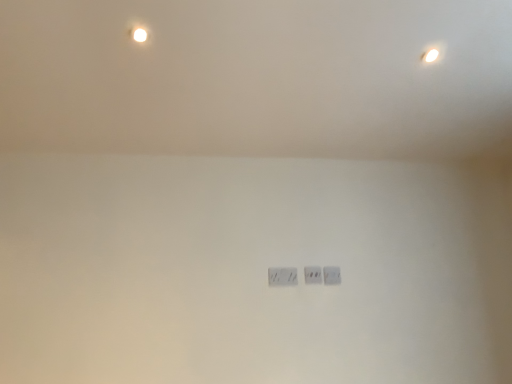
Question: From the image's perspective, is white plastic power plugs and sockets at center, which is counted as the first power plugs and sockets, starting from the left, over white plastic power plugs and sockets at center, placed as the third power plugs and sockets when sorted from left to right?

Choices:
 (A) yes
 (B) no

Answer: (B)

Question: Is the position of white plastic power plugs and sockets at center, marked as the 3th power plugs and sockets in a right-to-left arrangement, more distant than that of white plastic power plugs and sockets at center, the first power plugs and sockets positioned from the right?

Choices:
 (A) yes
 (B) no

Answer: (B)

Question: Considering the relative positions of white plastic power plugs and sockets at center, which is counted as the first power plugs and sockets, starting from the left, and white plastic power plugs and sockets at center, the first power plugs and sockets positioned from the right, in the image provided, is white plastic power plugs and sockets at center, which is counted as the first power plugs and sockets, starting from the left, to the left of white plastic power plugs and sockets at center, the first power plugs and sockets positioned from the right, from the viewer's perspective?

Choices:
 (A) yes
 (B) no

Answer: (A)

Question: Is white plastic power plugs and sockets at center, which is counted as the first power plugs and sockets, starting from the left, positioned far away from white plastic power plugs and sockets at center, the first power plugs and sockets positioned from the right?

Choices:
 (A) yes
 (B) no

Answer: (B)

Question: Is white plastic power plugs and sockets at center, marked as the 3th power plugs and sockets in a right-to-left arrangement, bigger than white plastic power plugs and sockets at center, the first power plugs and sockets positioned from the right?

Choices:
 (A) no
 (B) yes

Answer: (B)

Question: From a real-world perspective, is white plastic power plugs and sockets at center, which is counted as the first power plugs and sockets, starting from the left, positioned under white plastic power plugs and sockets at center, placed as the third power plugs and sockets when sorted from left to right, based on gravity?

Choices:
 (A) yes
 (B) no

Answer: (A)

Question: Is matte white light bulb at upper left closer to the viewer compared to white plastic power plugs and sockets at center, which is the second power plugs and sockets in left-to-right order?

Choices:
 (A) no
 (B) yes

Answer: (B)

Question: Can you confirm if matte white light bulb at upper left is wider than white plastic power plugs and sockets at center, which is the second power plugs and sockets in left-to-right order?

Choices:
 (A) yes
 (B) no

Answer: (A)

Question: Would you say white plastic power plugs and sockets at center, which is the second power plugs and sockets in left-to-right order, is part of matte white light bulb at upper left's contents?

Choices:
 (A) yes
 (B) no

Answer: (B)

Question: Can we say matte white light bulb at upper left lies outside white plastic power plugs and sockets at center, which ranks as the 2th power plugs and sockets in right-to-left order?

Choices:
 (A) yes
 (B) no

Answer: (A)

Question: Considering the relative positions of matte white light bulb at upper left and white plastic power plugs and sockets at center, which ranks as the 2th power plugs and sockets in right-to-left order, in the image provided, is matte white light bulb at upper left to the right of white plastic power plugs and sockets at center, which ranks as the 2th power plugs and sockets in right-to-left order, from the viewer's perspective?

Choices:
 (A) no
 (B) yes

Answer: (A)

Question: From the image's perspective, does matte white light bulb at upper left appear higher than white plastic power plugs and sockets at center, which ranks as the 2th power plugs and sockets in right-to-left order?

Choices:
 (A) no
 (B) yes

Answer: (B)

Question: Does white plastic power plugs and sockets at center, which is the second power plugs and sockets in left-to-right order, appear on the left side of white plastic power plugs and sockets at center, which is counted as the first power plugs and sockets, starting from the left?

Choices:
 (A) yes
 (B) no

Answer: (B)